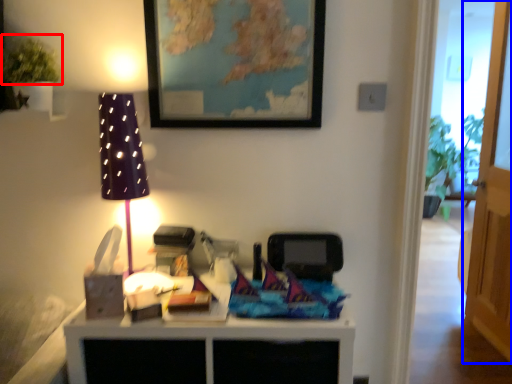
Question: Which object appears farthest to the camera in this image, plant (highlighted by a red box) or glass door (highlighted by a blue box)?

Choices:
 (A) plant
 (B) glass door

Answer: (B)